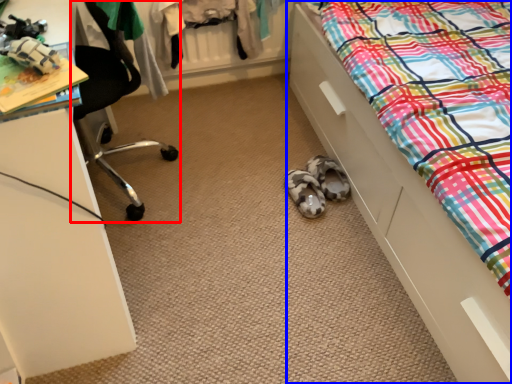
Question: Which of the following is the farthest to the observer, chair (highlighted by a red box) or bed (highlighted by a blue box)?

Choices:
 (A) chair
 (B) bed

Answer: (A)